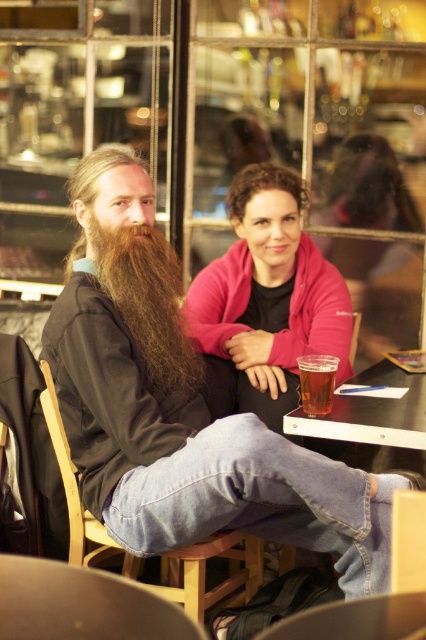
Does wooden chair at lower left appear on the left side of translucent plastic cup at lower center?

Yes, wooden chair at lower left is to the left of translucent plastic cup at lower center.

Between point (204, 561) and point (313, 394), which one is positioned behind?

Positioned behind is point (313, 394).

Who is more distant from viewer, (85, 540) or (328, 410)?

Positioned behind is point (85, 540).

The image size is (426, 640). I want to click on wooden chair at lower left, so click(206, 570).

Between point (48, 417) and point (302, 428), which one is positioned in front?

Point (302, 428) is in front.

Between point (198, 611) and point (388, 429), which one is positioned behind?

The point (198, 611) is more distant.

This screenshot has height=640, width=426. Identify the location of wooden chair at lower left. (206, 570).

Is pink fleece at center bigger than translucent plastic cup at lower center?

Indeed, pink fleece at center has a larger size compared to translucent plastic cup at lower center.

Is pink fleece at center smaller than translucent plastic cup at lower center?

No.

Describe the element at coordinates (270, 296) in the screenshot. The image size is (426, 640). I see `pink fleece at center` at that location.

This screenshot has width=426, height=640. I want to click on pink fleece at center, so click(x=270, y=296).